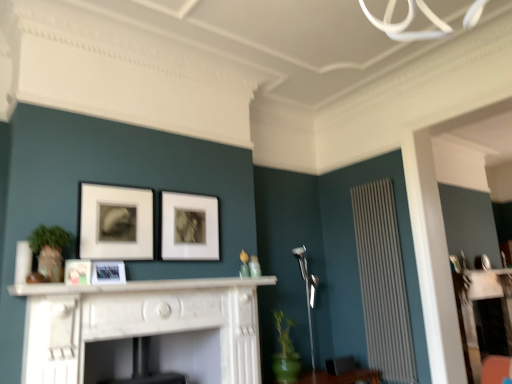
Question: From a real-world perspective, relative to matte white picture frame at center, placed as the second picture frame when sorted from left to right, is white glossy picture frame at center, marked as the fourth picture frame in a right-to-left arrangement, vertically above or below?

Choices:
 (A) below
 (B) above

Answer: (B)

Question: Is point (69, 281) closer or farther from the camera than point (114, 264)?

Choices:
 (A) closer
 (B) farther

Answer: (A)

Question: Estimate the real-world distances between objects in this image. Which object is closer to the white textured radiator at right?

Choices:
 (A) matte black picture frame at center, arranged as the 4th picture frame when viewed from the left
 (B) matte white picture frame at upper left, which is counted as the third picture frame, starting from the left
 (C) white marble fireplace at center
 (D) white marble fireplace at center
 (E) white glossy picture frame at center, marked as the fourth picture frame in a right-to-left arrangement

Answer: (C)

Question: Which of these objects is positioned closest to the matte black picture frame at center, arranged as the 4th picture frame when viewed from the left?

Choices:
 (A) white textured radiator at right
 (B) matte white picture frame at upper left, which is counted as the third picture frame, starting from the left
 (C) white glossy picture frame at center, marked as the fourth picture frame in a right-to-left arrangement
 (D) matte white picture frame at center, placed as the second picture frame when sorted from left to right
 (E) white marble fireplace at center

Answer: (B)